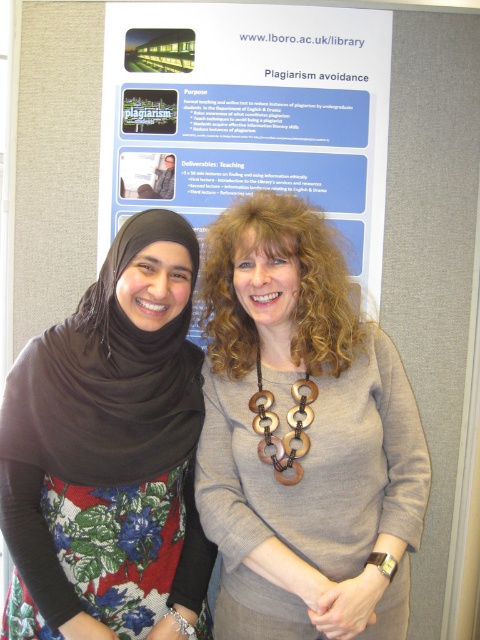
Question: Which point is closer to the camera?

Choices:
 (A) (100, 358)
 (B) (268, 509)

Answer: (B)

Question: Is matte gray sweater at center further to the viewer compared to blue paper at upper center?

Choices:
 (A) yes
 (B) no

Answer: (B)

Question: Based on their relative distances, which object is farther from the blue paper at upper center?

Choices:
 (A) floral fabric dress at center
 (B) matte gray sweater at center
 (C) wooden rings at center

Answer: (C)

Question: Is matte gray sweater at center bigger than floral fabric dress at center?

Choices:
 (A) yes
 (B) no

Answer: (A)

Question: Which object is closer to the camera taking this photo?

Choices:
 (A) floral fabric dress at center
 (B) blue paper at upper center
 (C) matte gray sweater at center
 (D) wooden rings at center

Answer: (C)

Question: Does floral fabric dress at center have a larger size compared to blue paper at upper center?

Choices:
 (A) yes
 (B) no

Answer: (A)